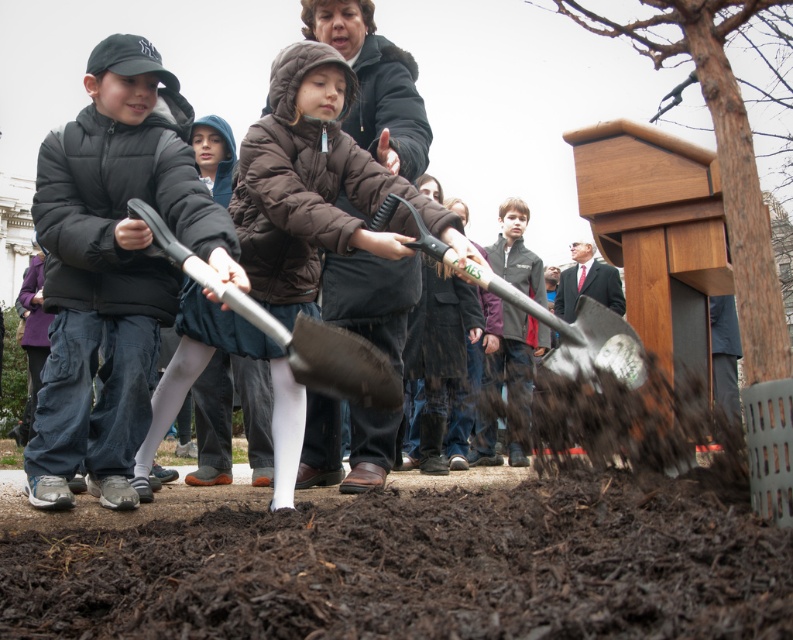
You are a landscape architect designing a garden path. You need to place a decorative stone between the dark brown mulch at lower center and the matte black jacket at left. Based on their widths, which object should the stone be placed closer to?

The dark brown mulch at lower center might be wider than the matte black jacket at left, so the stone should be placed closer to the dark brown mulch at lower center to ensure proper spacing.

You are a photographer at the tree planting event. You want to take a photo of the silver metallic shovel at center without the matte black jacket at left appearing in the frame. Is this possible given their positions?

The matte black jacket at left is positioned over the silver metallic shovel at center, so it would block the shovel in the photo. To avoid the jacket, you need to adjust your angle or move the jacket.